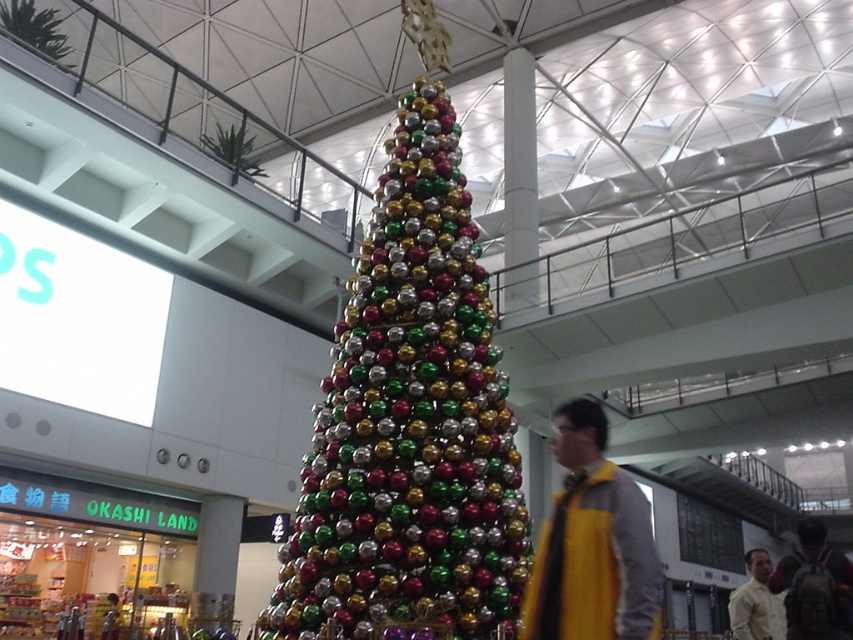
You are a customer in the mall looking at the festive display. You see the yellow wool sweater at center and the yellow fabric shirt at lower right. Which item is closer to you?

The yellow wool sweater at center is closer to you because it is in front of the yellow fabric shirt at lower right.

You are standing in the shopping mall and see the festive scene. There is a yellow fabric at center. Can you estimate its position relative to the tall cone structure?

The yellow fabric at center is located at point coordinates of 0.852 on the x axis and 0.695 on the y axis relative to the tall cone structure.

You are a photographer standing in the shopping mall and want to take a picture of the yellow fabric at center and the yellow fabric shirt at lower right. Which object is located to the left of the other?

The yellow fabric at center is positioned on the left side of yellow fabric shirt at lower right.